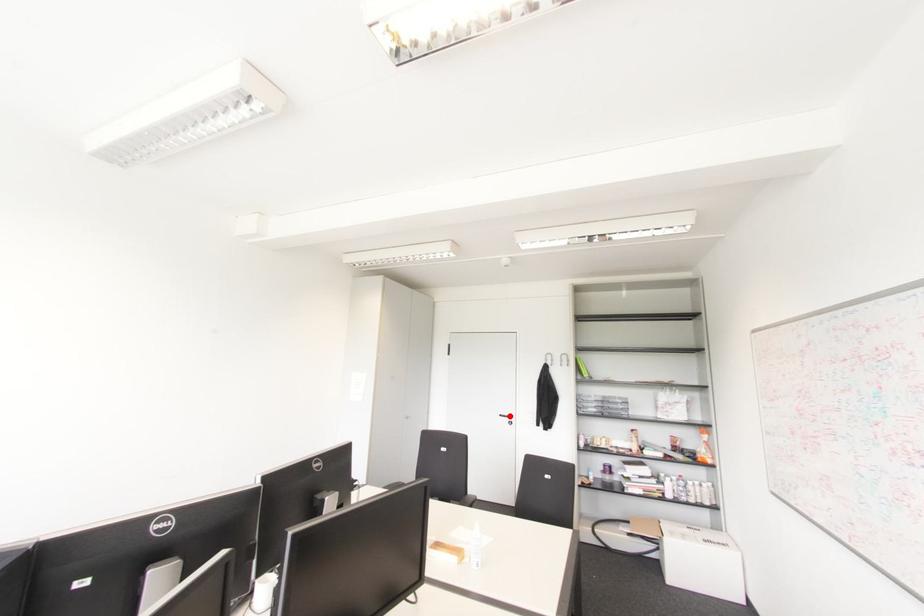
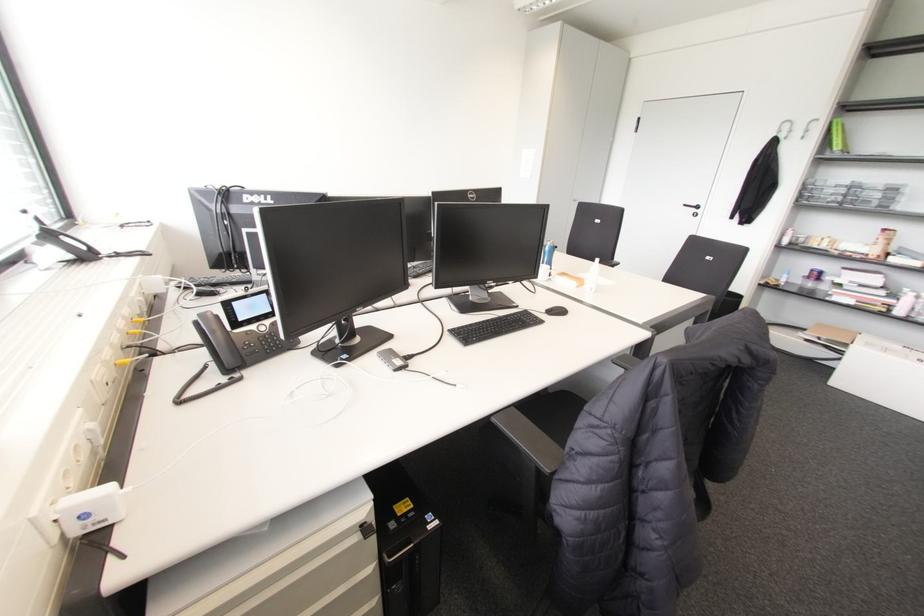
The point at the highlighted location is marked in the first image. Where is the corresponding point in the second image?

(697, 207)